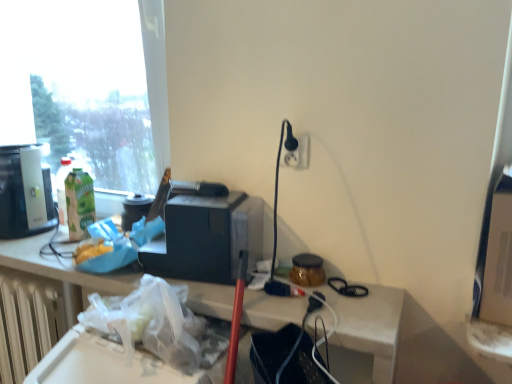
At what (x,y) coordinates should I click in order to perform the action: click on matte black coffee machine at left. Please return your answer as a coordinate pair (x, y). Looking at the image, I should click on (24, 192).

What do you see at coordinates (369, 326) in the screenshot? I see `translucent plastic bag at lower center` at bounding box center [369, 326].

Locate an element on the screen. green matte carton at left is located at coordinates tap(79, 204).

What do you see at coordinates (90, 83) in the screenshot?
I see `transparent glass window at upper left` at bounding box center [90, 83].

What is the approximate height of black plastic toaster at center, which is the second appliance in right-to-left order?

black plastic toaster at center, which is the second appliance in right-to-left order, is 9.78 inches tall.

This screenshot has height=384, width=512. In order to click on white plastic electric outlet at upper right in this screenshot , I will do `click(297, 154)`.

Looking at the image, does transparent glass window at upper left seem bigger or smaller compared to translucent plastic bag at lower center?

In the image, transparent glass window at upper left appears to be larger than translucent plastic bag at lower center.

Considering the relative positions of transparent glass window at upper left and translucent plastic bag at lower center in the image provided, is transparent glass window at upper left behind translucent plastic bag at lower center?

Yes.

Based on their positions, is transparent glass window at upper left located to the left or right of translucent plastic bag at lower center?

Based on their positions, transparent glass window at upper left is located to the left of translucent plastic bag at lower center.

Which is farther from the camera, (89, 113) or (326, 285)?

Point (89, 113)

Is transparent glass window at upper left a part of translucent glass jar at center, positioned as the 2th appliance in left-to-right order?

Actually, transparent glass window at upper left is outside translucent glass jar at center, positioned as the 2th appliance in left-to-right order.

Relative to transparent glass window at upper left, is translucent glass jar at center, positioned as the 2th appliance in left-to-right order, in front or behind?

Visually, translucent glass jar at center, positioned as the 2th appliance in left-to-right order, is located in front of transparent glass window at upper left.

Does translucent glass jar at center, positioned as the 2th appliance in left-to-right order, turn towards transparent glass window at upper left?

No, translucent glass jar at center, positioned as the 2th appliance in left-to-right order, is not aimed at transparent glass window at upper left.

From the image's perspective, relative to white plastic electric outlet at upper right, is translucent glass jar at center, acting as the 1th appliance starting from the right, above or below?

translucent glass jar at center, acting as the 1th appliance starting from the right, is below white plastic electric outlet at upper right.

Consider the image. Does translucent glass jar at center, positioned as the 2th appliance in left-to-right order, have a greater height compared to white plastic electric outlet at upper right?

No.

From the picture: Considering the relative positions of translucent glass jar at center, acting as the 1th appliance starting from the right, and white plastic electric outlet at upper right in the image provided, is translucent glass jar at center, acting as the 1th appliance starting from the right, to the right of white plastic electric outlet at upper right from the viewer's perspective?

Indeed, translucent glass jar at center, acting as the 1th appliance starting from the right, is positioned on the right side of white plastic electric outlet at upper right.

Would you say translucent plastic bag at lower center is outside white plastic electric outlet at upper right?

That's correct, translucent plastic bag at lower center is outside of white plastic electric outlet at upper right.

The width and height of the screenshot is (512, 384). What are the coordinates of `electric outlet above the translucent plastic bag at lower center (from a real-world perspective)` in the screenshot? It's located at (297, 154).

From a real-world perspective, is translucent plastic bag at lower center physically below white plastic electric outlet at upper right?

Yes, from a real-world perspective, translucent plastic bag at lower center is beneath white plastic electric outlet at upper right.

Is translucent plastic bag at lower center further to camera compared to white plastic electric outlet at upper right?

No.

From a real-world perspective, is matte black coffee machine at left above or below white plastic electric outlet at upper right?

From a real-world perspective, matte black coffee machine at left is physically below white plastic electric outlet at upper right.

Does point (18, 155) come closer to viewer compared to point (282, 158)?

No, it is behind (282, 158).

Which is in front, matte black coffee machine at left or white plastic electric outlet at upper right?

white plastic electric outlet at upper right.

Is matte black coffee machine at left taller than white plastic electric outlet at upper right?

Indeed, matte black coffee machine at left has a greater height compared to white plastic electric outlet at upper right.

From a real-world perspective, is black plastic toaster at center, which is the 1th appliance in left-to-right order, physically above white plastic radiator at lower left?

Indeed, from a real-world perspective, black plastic toaster at center, which is the 1th appliance in left-to-right order, stands above white plastic radiator at lower left.

Considering the points (207, 221) and (39, 334), which point is in front, point (207, 221) or point (39, 334)?

The point (207, 221) is more forward.

From the image's perspective, which appliance is the 2nd one above the white plastic radiator at lower left? Please provide its 2D coordinates.

[(206, 234)]

Could you measure the distance between black plastic toaster at center, which is the second appliance in right-to-left order, and white plastic radiator at lower left?

black plastic toaster at center, which is the second appliance in right-to-left order, and white plastic radiator at lower left are 25.39 inches apart from each other.

Can we say green matte carton at left lies outside translucent plastic bag at lower center?

Absolutely, green matte carton at left is external to translucent plastic bag at lower center.

From a real-world perspective, which object stands above the other?

green matte carton at left is physically above.

Is green matte carton at left looking in the opposite direction of translucent plastic bag at lower center?

That's not correct — green matte carton at left is not looking away from translucent plastic bag at lower center.

The height and width of the screenshot is (384, 512). Identify the location of desk below the transparent glass window at upper left (from a real-world perspective). (369, 326).

Locate an element on the screen. The image size is (512, 384). window that appears above the translucent glass jar at center, positioned as the 2th appliance in left-to-right order (from a real-world perspective) is located at coordinates (90, 83).

When comparing their distances from matte black coffee machine at left, does white plastic radiator at lower left or black plastic toaster at center, which is the second appliance in right-to-left order, seem further?

black plastic toaster at center, which is the second appliance in right-to-left order.

Estimate the real-world distances between objects in this image. Which object is further from white plastic radiator at lower left, translucent plastic bag at lower center or transparent glass window at upper left?

transparent glass window at upper left.

Which object lies further to the anchor point white plastic radiator at lower left, transparent glass window at upper left or matte black coffee machine at left?

Based on the image, transparent glass window at upper left appears to be further to white plastic radiator at lower left.

In the scene shown: When comparing their distances from translucent plastic bag at lower center, does matte black coffee machine at left or translucent glass jar at center, positioned as the 2th appliance in left-to-right order, seem further?

matte black coffee machine at left lies further to translucent plastic bag at lower center than the other object.

From the image, which object appears to be farther from white plastic radiator at lower left, black plastic toaster at center, which is the 1th appliance in left-to-right order, or white plastic electric outlet at upper right?

white plastic electric outlet at upper right lies further to white plastic radiator at lower left than the other object.

Based on their spatial positions, is white plastic radiator at lower left or translucent glass jar at center, acting as the 1th appliance starting from the right, further from transparent glass window at upper left?

Among the two, translucent glass jar at center, acting as the 1th appliance starting from the right, is located further to transparent glass window at upper left.

Which object lies nearer to the anchor point green matte carton at left, translucent plastic bag at lower center or transparent glass window at upper left?

Among the two, translucent plastic bag at lower center is located nearer to green matte carton at left.

Estimate the real-world distances between objects in this image. Which object is closer to translucent plastic bag at lower center, green matte carton at left or white plastic radiator at lower left?

Among the two, white plastic radiator at lower left is located nearer to translucent plastic bag at lower center.

Where is `appliance between transparent glass window at upper left and white plastic electric outlet at upper right`? The height and width of the screenshot is (384, 512). appliance between transparent glass window at upper left and white plastic electric outlet at upper right is located at coordinates (206, 234).

Locate an element on the screen. bottle between transparent glass window at upper left and white plastic radiator at lower left from top to bottom is located at coordinates (79, 204).

Where is `desk between transparent glass window at upper left and translucent glass jar at center, acting as the 1th appliance starting from the right, from left to right`? The height and width of the screenshot is (384, 512). desk between transparent glass window at upper left and translucent glass jar at center, acting as the 1th appliance starting from the right, from left to right is located at coordinates (369, 326).

This screenshot has width=512, height=384. Find the location of `window located between matte black coffee machine at left and translucent glass jar at center, positioned as the 2th appliance in left-to-right order, in the left-right direction`. window located between matte black coffee machine at left and translucent glass jar at center, positioned as the 2th appliance in left-to-right order, in the left-right direction is located at coordinates (90, 83).